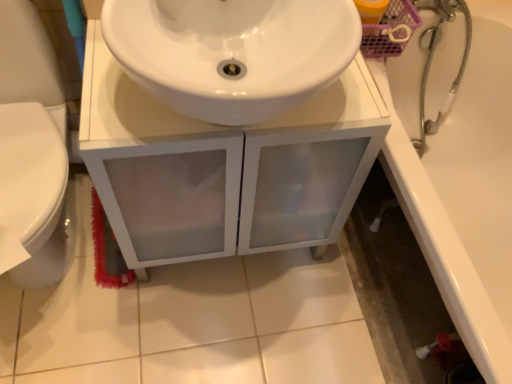
Image resolution: width=512 pixels, height=384 pixels. Find the location of `free space in front of white frosted glass cabinet at center`. free space in front of white frosted glass cabinet at center is located at coordinates (204, 332).